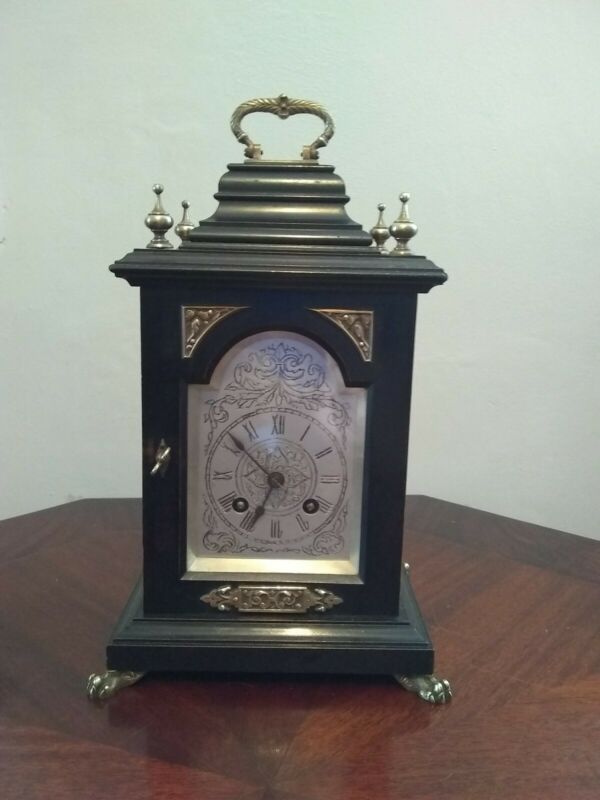
The width and height of the screenshot is (600, 800). I want to click on space in table to the right of clock, so click(511, 622).